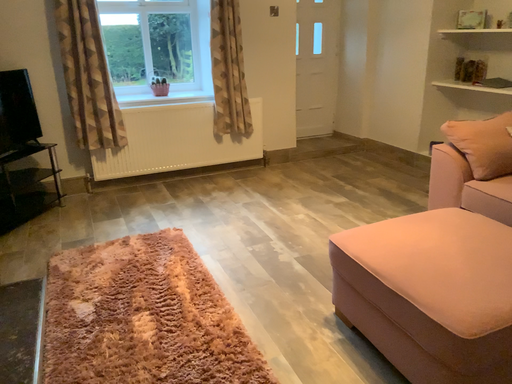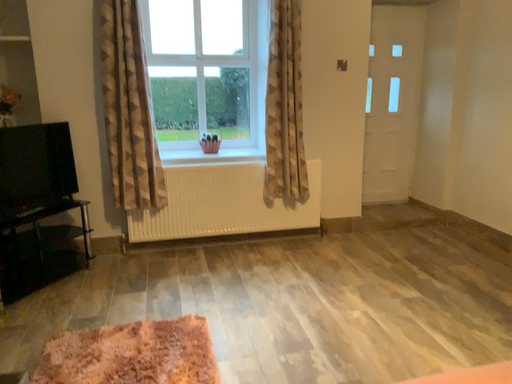
Question: How did the camera likely rotate when shooting the video?

Choices:
 (A) rotated upward
 (B) rotated downward

Answer: (A)